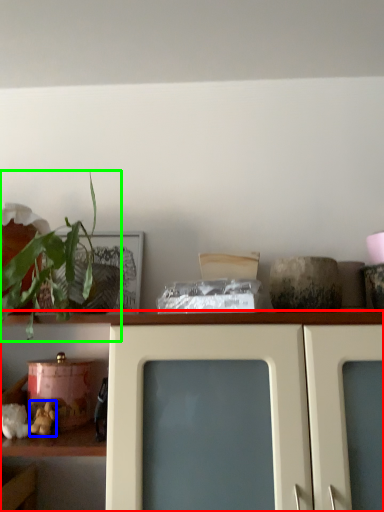
Question: Based on their relative distances, which object is nearer to shelf (highlighted by a red box)? Choose from stuff (highlighted by a blue box) and houseplant (highlighted by a green box).

Choices:
 (A) stuff
 (B) houseplant

Answer: (B)